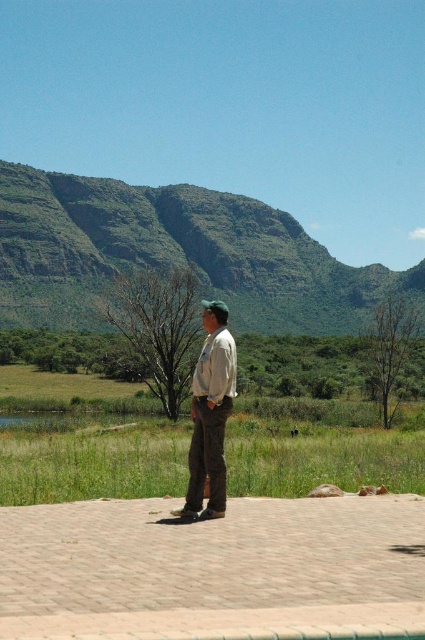
Does point (362, 282) come behind point (87, 467)?

Yes, point (362, 282) is farther from viewer.

Which is behind, point (277, 292) or point (88, 460)?

The point (277, 292) is behind.

Where is `green rocky mountain at upper center`? green rocky mountain at upper center is located at coordinates (173, 253).

Is green grass at center wider than khaki pants at center?

Yes.

Can you confirm if green grass at center is thinner than khaki pants at center?

In fact, green grass at center might be wider than khaki pants at center.

Which is in front, point (51, 484) or point (214, 458)?

Positioned in front is point (214, 458).

Identify the location of green grass at center. The width and height of the screenshot is (425, 640). (91, 458).

Is green rocky mountain at upper center shorter than khaki pants at center?

Incorrect, green rocky mountain at upper center's height does not fall short of khaki pants at center's.

Does green rocky mountain at upper center appear on the right side of khaki pants at center?

In fact, green rocky mountain at upper center is to the left of khaki pants at center.

Find the location of a particular element. The width and height of the screenshot is (425, 640). green rocky mountain at upper center is located at coordinates (173, 253).